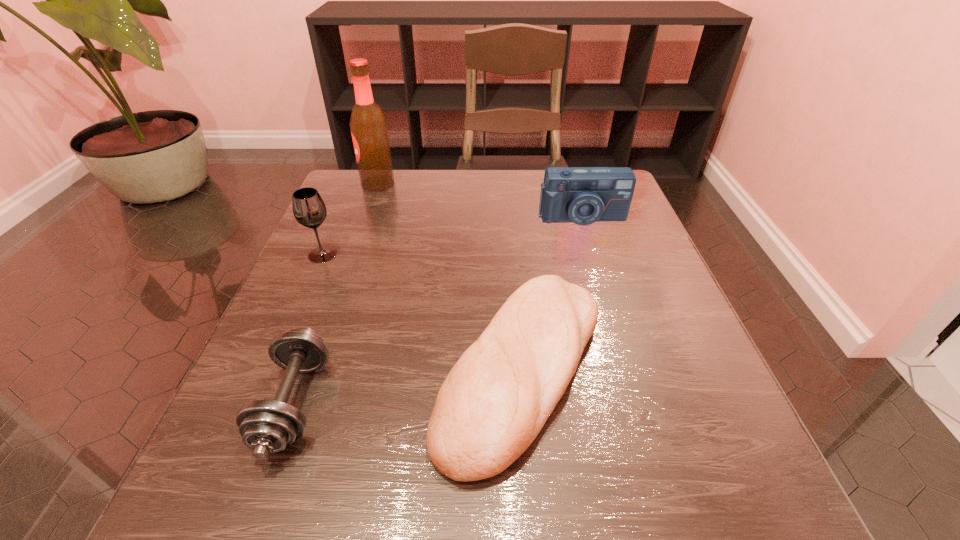
This screenshot has width=960, height=540. What are the coordinates of `free spot between the farthest object and the wineglass` in the screenshot? It's located at (350, 219).

I want to click on free point between the bread and the second tallest object, so click(422, 312).

Locate which object ranks third in proximity to the dumbbell. Please provide its 2D coordinates. Your answer should be formatted as a tuple, i.e. [(x, y)], where the tuple contains the x and y coordinates of a point satisfying the conditions above.

[(583, 195)]

Find the location of a particular element. object that is the third closest to the fourth shortest object is located at coordinates tap(495, 400).